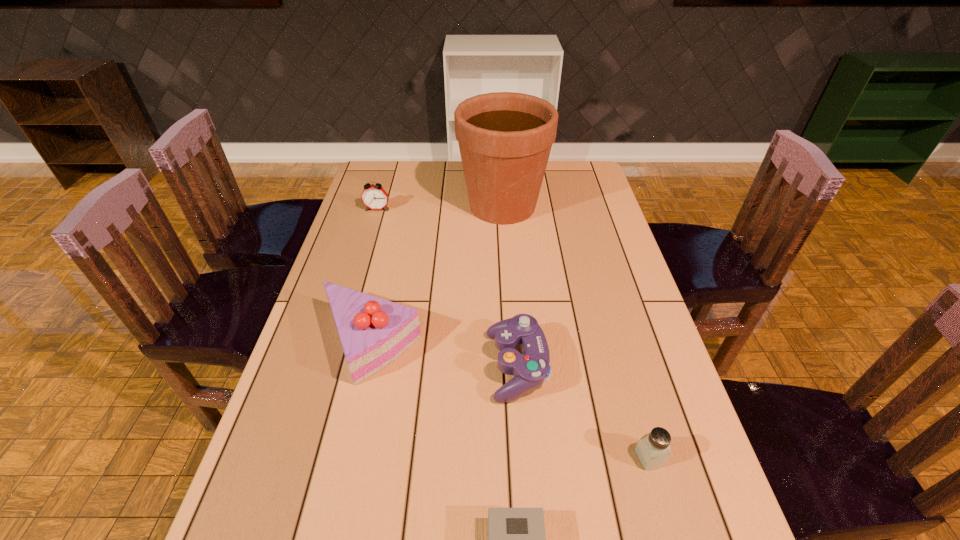
Locate an element on the screen. This screenshot has height=540, width=960. blank space located on the back of the control is located at coordinates (513, 309).

Identify the location of vacant region located 0.090m on the front of the rightmost object. The width and height of the screenshot is (960, 540). (666, 519).

Where is `object that is at the far edge`? Image resolution: width=960 pixels, height=540 pixels. object that is at the far edge is located at coordinates (505, 138).

Image resolution: width=960 pixels, height=540 pixels. Find the location of `cake located at the left edge`. cake located at the left edge is located at coordinates (374, 332).

Find the location of a particular element. The image size is (960, 540). alarm clock located at the left edge is located at coordinates (374, 197).

Identify the location of object that is at the right edge. This screenshot has width=960, height=540. click(653, 449).

The image size is (960, 540). I want to click on vacant space at the far edge of the desktop, so click(x=449, y=191).

Locate an element on the screen. This screenshot has height=540, width=960. free spot at the left edge of the desktop is located at coordinates (290, 405).

Image resolution: width=960 pixels, height=540 pixels. In the image, there is a desktop. Find the location of `free space at the right edge`. free space at the right edge is located at coordinates (622, 305).

The width and height of the screenshot is (960, 540). I want to click on vacant point at the far left corner, so click(374, 170).